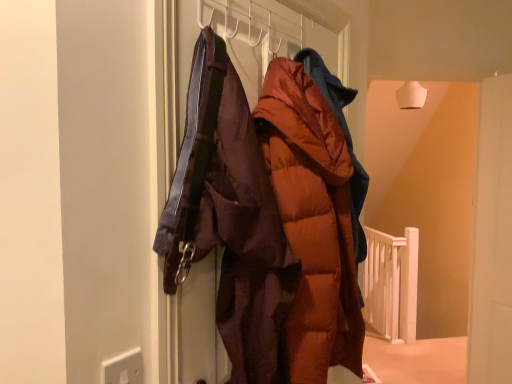
Question: Should I look upward or downward to see orange puffy coat at center?

Choices:
 (A) up
 (B) down

Answer: (B)

Question: Considering the relative sizes of matte brown puffer jacket at center and orange puffy coat at center in the image provided, is matte brown puffer jacket at center shorter than orange puffy coat at center?

Choices:
 (A) yes
 (B) no

Answer: (A)

Question: From the image's perspective, is matte brown puffer jacket at center on orange puffy coat at center?

Choices:
 (A) no
 (B) yes

Answer: (B)

Question: Can we say matte brown puffer jacket at center lies outside orange puffy coat at center?

Choices:
 (A) yes
 (B) no

Answer: (A)

Question: Can you confirm if matte brown puffer jacket at center is thinner than orange puffy coat at center?

Choices:
 (A) no
 (B) yes

Answer: (B)

Question: From a real-world perspective, is matte brown puffer jacket at center located beneath orange puffy coat at center?

Choices:
 (A) yes
 (B) no

Answer: (B)

Question: Is matte brown puffer jacket at center facing away from orange puffy coat at center?

Choices:
 (A) yes
 (B) no

Answer: (B)

Question: From the image's perspective, is matte brown puffer jacket at center located beneath white plastic electric outlet at lower left?

Choices:
 (A) no
 (B) yes

Answer: (A)

Question: Does matte brown puffer jacket at center have a greater width compared to white plastic electric outlet at lower left?

Choices:
 (A) no
 (B) yes

Answer: (B)

Question: Does matte brown puffer jacket at center come in front of white plastic electric outlet at lower left?

Choices:
 (A) yes
 (B) no

Answer: (B)

Question: Considering the relative sizes of matte brown puffer jacket at center and white plastic electric outlet at lower left in the image provided, is matte brown puffer jacket at center smaller than white plastic electric outlet at lower left?

Choices:
 (A) yes
 (B) no

Answer: (B)

Question: Is matte brown puffer jacket at center in contact with white plastic electric outlet at lower left?

Choices:
 (A) no
 (B) yes

Answer: (A)

Question: From a real-world perspective, is matte brown puffer jacket at center physically below white plastic electric outlet at lower left?

Choices:
 (A) yes
 (B) no

Answer: (B)

Question: Can you confirm if matte brown puffer jacket at center is positioned to the left of white wooden rail at lower right?

Choices:
 (A) yes
 (B) no

Answer: (A)